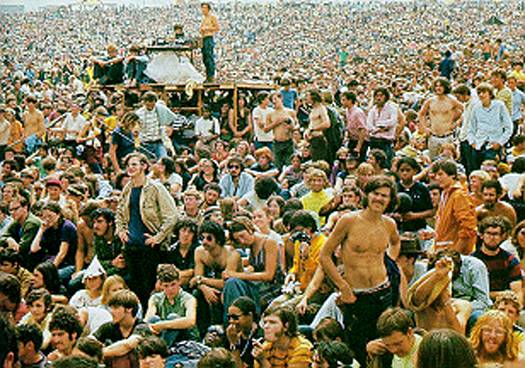
In order to click on stage in this screenshot , I will do `click(182, 87)`.